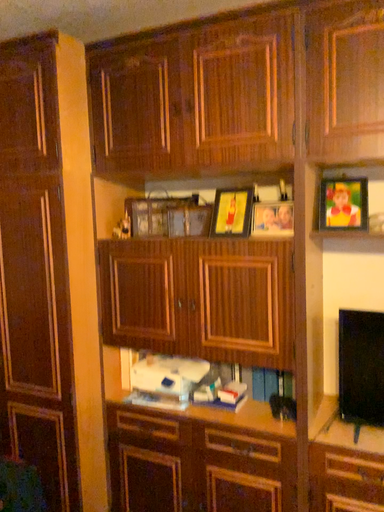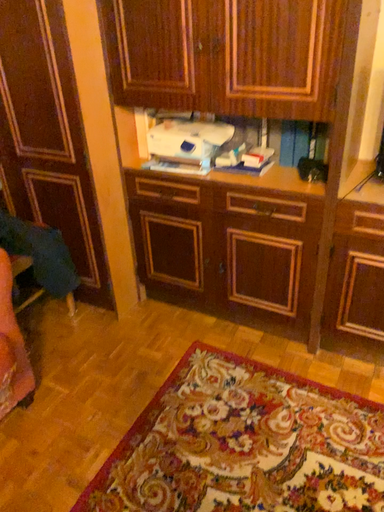
Question: Which way did the camera rotate in the video?

Choices:
 (A) rotated upward
 (B) rotated downward

Answer: (B)